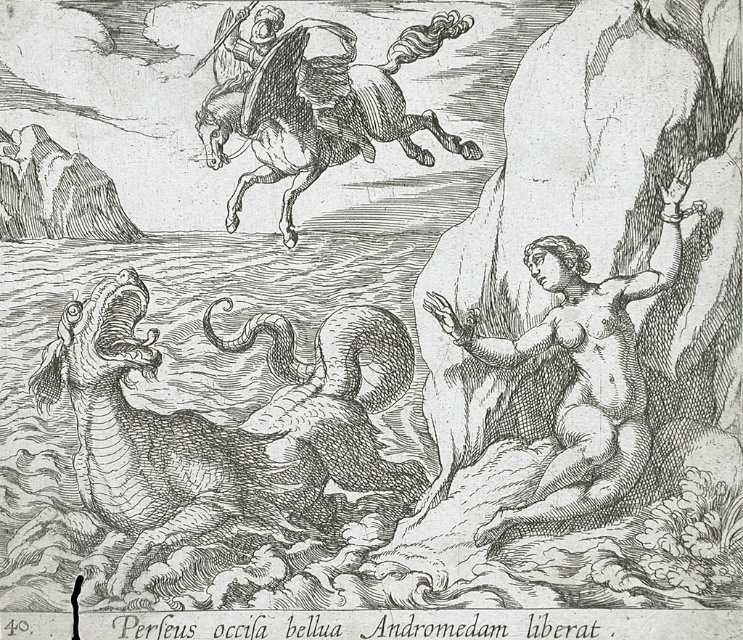
Does gray textured sea monster at lower left appear on the left side of smooth white horse at upper center?

Yes, gray textured sea monster at lower left is to the left of smooth white horse at upper center.

Locate an element on the screen. Image resolution: width=743 pixels, height=640 pixels. gray textured sea monster at lower left is located at coordinates (230, 432).

Which is in front, point (377, 401) or point (285, 38)?

Point (285, 38) is in front.

Identify the location of gray textured sea monster at lower left. (230, 432).

In order to click on smooth skin nude figure at right in this screenshot , I will do click(x=580, y=371).

Does smooth skin nude figure at right have a lesser width compared to smooth white horse at upper center?

Yes, smooth skin nude figure at right is thinner than smooth white horse at upper center.

The width and height of the screenshot is (743, 640). I want to click on smooth skin nude figure at right, so click(580, 371).

Which is behind, point (175, 436) or point (623, 376)?

The point (175, 436) is behind.

Which is below, gray textured sea monster at lower left or smooth skin nude figure at right?

smooth skin nude figure at right is lower down.

Image resolution: width=743 pixels, height=640 pixels. Identify the location of gray textured sea monster at lower left. (230, 432).